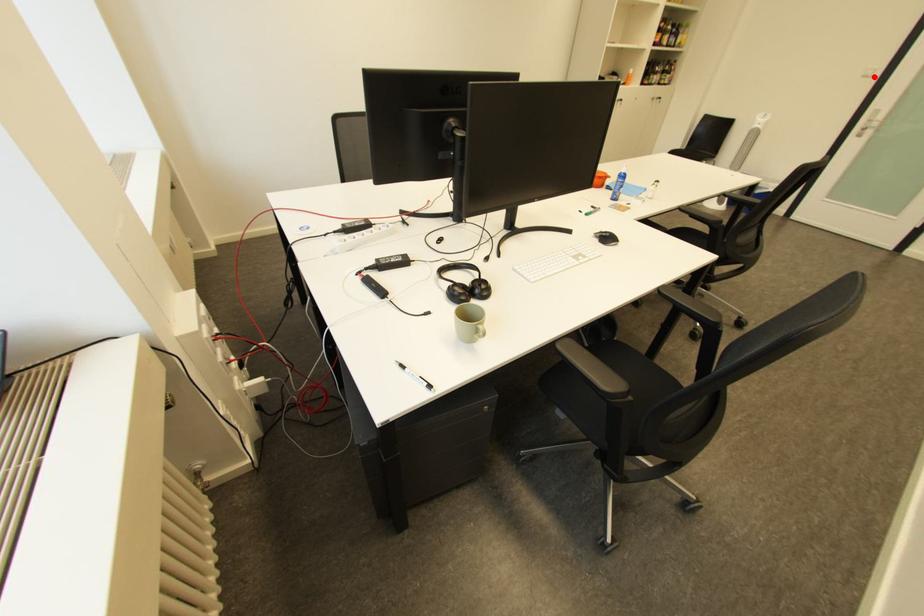
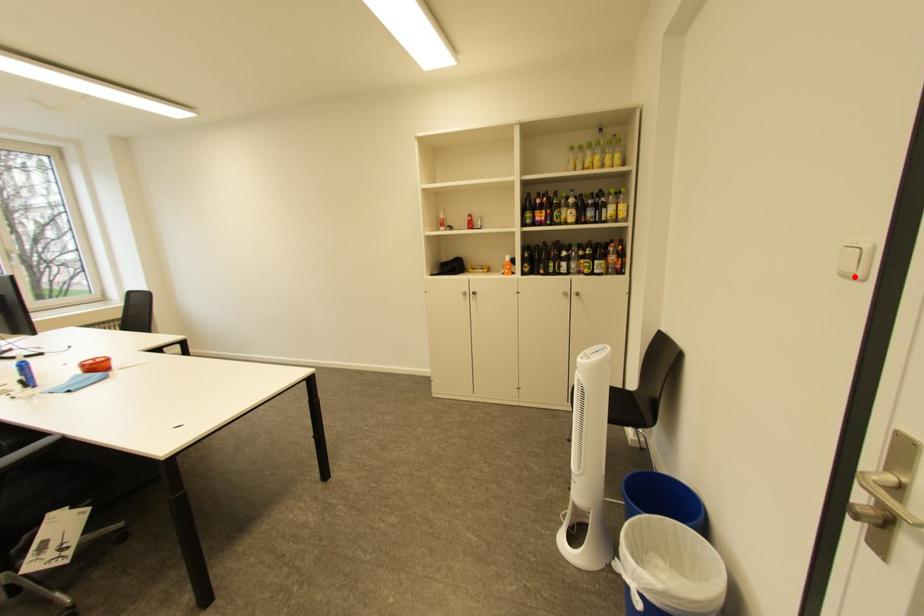
I am providing you with two images of the same scene from different viewpoints. A red point is marked on the first image and another point is marked on the second image. Is the marked point in image1 the same physical position as the marked point in image2?

Yes